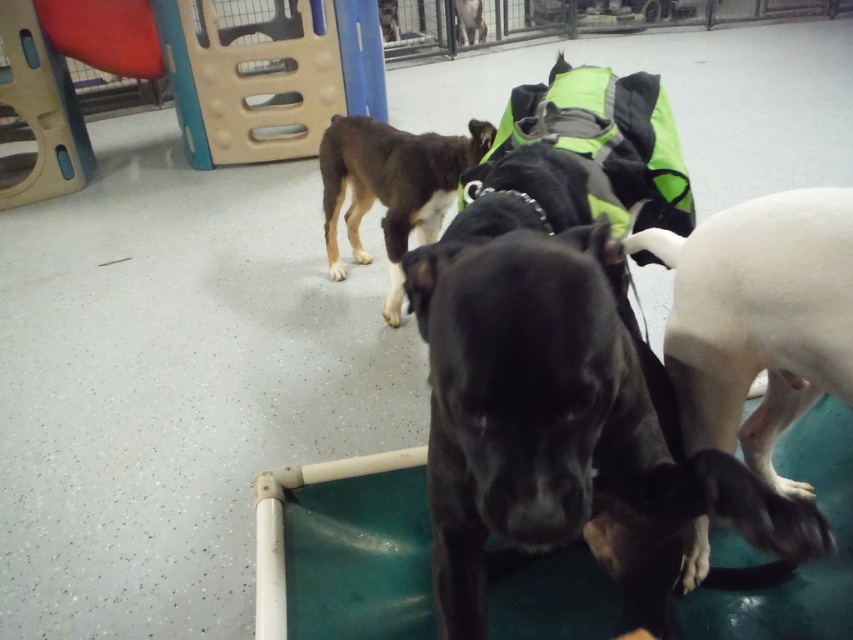
You are standing in a dog training facility and want to reach a point exactly 30 inches away from your current position. Based on the image, is the point at coordinates point (416, 269) within that 30 inch range?

The distance between point (416, 269) and the viewer is 31.31 inches, which is slightly beyond the 30 inch range, so the point is just outside the desired distance.

You are standing at the point labeled point (473, 20) and want to move towards the point labeled point (808, 346) in the dog training facility. Which direction should you move to get closer to your target point?

You should move forward because point (808, 346) is closer to the camera than point (473, 20), meaning it is in front of your current position.

You are a trainer standing at the camera position. You need to reach the black smooth dog at center with a treat. Can you hand the treat to the dog without moving your feet?

The black smooth dog at center is 23.80 inches from camera, so yes, the trainer can hand the treat to the dog without moving their feet as the distance is within reach.